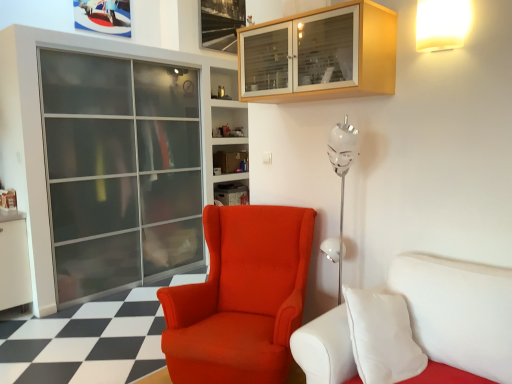
Question: Can you confirm if matte plastic shelf at center is positioned to the right of white matte wall lamp at upper right?

Choices:
 (A) no
 (B) yes

Answer: (A)

Question: From the image's perspective, does matte plastic shelf at center appear lower than white matte wall lamp at upper right?

Choices:
 (A) no
 (B) yes

Answer: (B)

Question: Is matte plastic shelf at center oriented away from white matte wall lamp at upper right?

Choices:
 (A) yes
 (B) no

Answer: (B)

Question: Is there a large distance between matte plastic shelf at center and white matte wall lamp at upper right?

Choices:
 (A) no
 (B) yes

Answer: (B)

Question: Does matte plastic shelf at center have a lesser height compared to white matte wall lamp at upper right?

Choices:
 (A) yes
 (B) no

Answer: (A)

Question: From a real-world perspective, is satin orange armchair at center physically located above or below transparent glass screen door at left?

Choices:
 (A) above
 (B) below

Answer: (B)

Question: Looking at the image, does satin orange armchair at center seem bigger or smaller compared to transparent glass screen door at left?

Choices:
 (A) small
 (B) big

Answer: (A)

Question: In the image, is satin orange armchair at center positioned in front of or behind transparent glass screen door at left?

Choices:
 (A) behind
 (B) front

Answer: (B)

Question: In the image, is satin orange armchair at center on the left side or the right side of transparent glass screen door at left?

Choices:
 (A) left
 (B) right

Answer: (B)

Question: Is white leather studio couch at lower right to the left or to the right of matte plastic shelf at center in the image?

Choices:
 (A) right
 (B) left

Answer: (A)

Question: Is point 333,340 closer or farther from the camera than point 220,185?

Choices:
 (A) farther
 (B) closer

Answer: (B)

Question: From a real-world perspective, relative to matte plastic shelf at center, is white leather studio couch at lower right vertically above or below?

Choices:
 (A) below
 (B) above

Answer: (A)

Question: In the image, is white leather studio couch at lower right positioned in front of or behind matte plastic shelf at center?

Choices:
 (A) behind
 (B) front

Answer: (B)

Question: From the image's perspective, is wooden cabinet at upper center above or below white matte wall lamp at upper right?

Choices:
 (A) above
 (B) below

Answer: (B)

Question: Considering the positions of point (294, 64) and point (428, 11), is point (294, 64) closer or farther from the camera than point (428, 11)?

Choices:
 (A) closer
 (B) farther

Answer: (B)